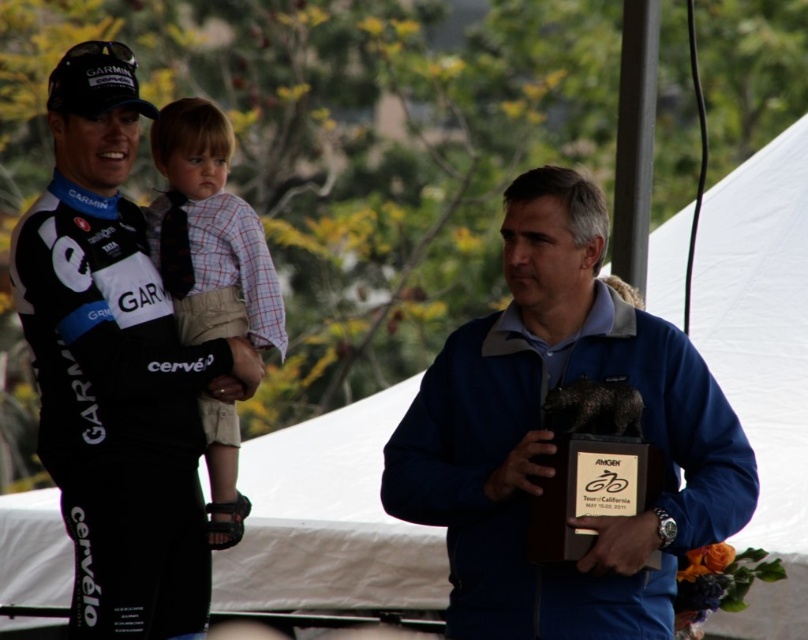
Is point (671, 506) more distant than point (226, 445)?

No, (671, 506) is in front of (226, 445).

Is point (457, 548) farther from viewer compared to point (213, 304)?

No, (457, 548) is in front of (213, 304).

You are a GUI agent. You are given a task and a screenshot of the screen. Output one action in this format:
    pyautogui.click(x=<x>, y=<y>)
    Task: Click on the blue fabric jacket at center
    This screenshot has height=640, width=808.
    Given the screenshot: What is the action you would take?
    pyautogui.click(x=553, y=440)

Does matte black cycling jersey at center appear under plaid shirt at center?

Indeed, matte black cycling jersey at center is positioned under plaid shirt at center.

Who is higher up, matte black cycling jersey at center or plaid shirt at center?

Positioned higher is plaid shirt at center.

Between point (121, 605) and point (202, 124), which one is positioned behind?

The point (202, 124) is more distant.

In order to click on matte black cycling jersey at center in this screenshot , I will do `click(116, 368)`.

Can you confirm if blue fabric jacket at center is bigger than matte black cycling jersey at center?

Correct, blue fabric jacket at center is larger in size than matte black cycling jersey at center.

Which is above, blue fabric jacket at center or matte black cycling jersey at center?

matte black cycling jersey at center

Between point (657, 438) and point (154, 508), which one is positioned in front?

Positioned in front is point (657, 438).

Locate an element on the screen. Image resolution: width=808 pixels, height=640 pixels. blue fabric jacket at center is located at coordinates (553, 440).